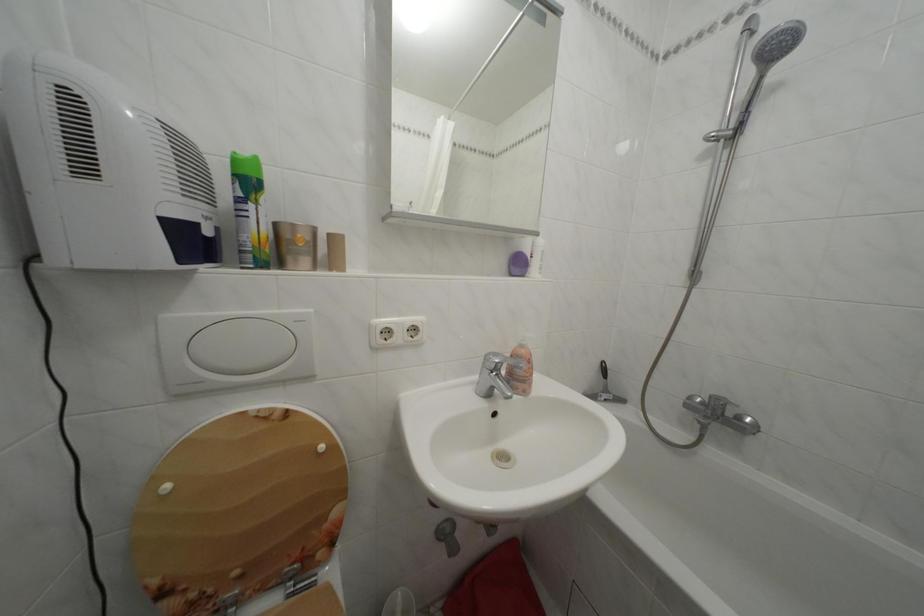
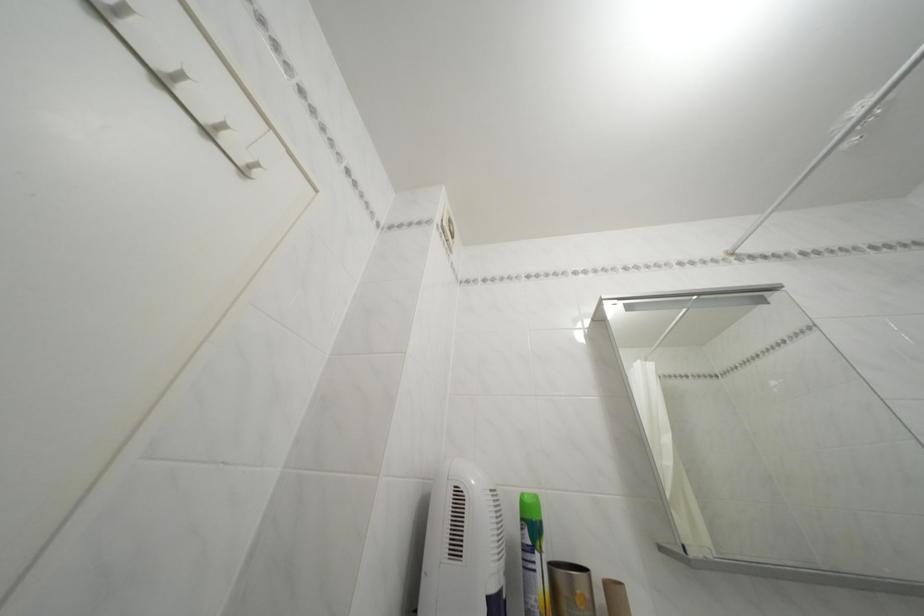
Locate, in the second image, the point that corresponds to point 242,182 in the first image.

(531, 525)